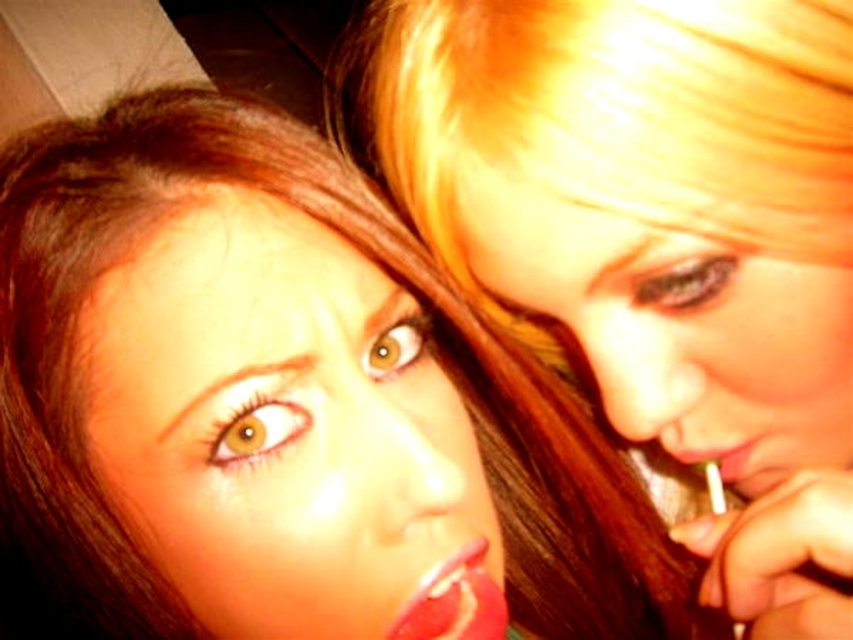
Does smooth skin face at upper right appear on the right side of shiny red lipstick at center?

No, smooth skin face at upper right is not to the right of shiny red lipstick at center.

You are a GUI agent. You are given a task and a screenshot of the screen. Output one action in this format:
    pyautogui.click(x=<x>, y=<y>)
    Task: Click on the smooth skin face at upper right
    The width and height of the screenshot is (853, 640).
    Given the screenshot: What is the action you would take?
    pyautogui.click(x=277, y=401)

Does shiny red lipstick at center have a smaller size compared to smooth glossy lips at center?

Actually, shiny red lipstick at center might be larger than smooth glossy lips at center.

Is point (792, 392) less distant than point (753, 467)?

Yes.

This screenshot has height=640, width=853. Identify the location of shiny red lipstick at center. (645, 220).

Does shiny red lipstick at center have a greater width compared to shiny red lipstick at lower right?

Yes.

Who is more distant from viewer, (525, 305) or (413, 602)?

The point (525, 305) is more distant.

The image size is (853, 640). In order to click on shiny red lipstick at center in this screenshot , I will do `click(645, 220)`.